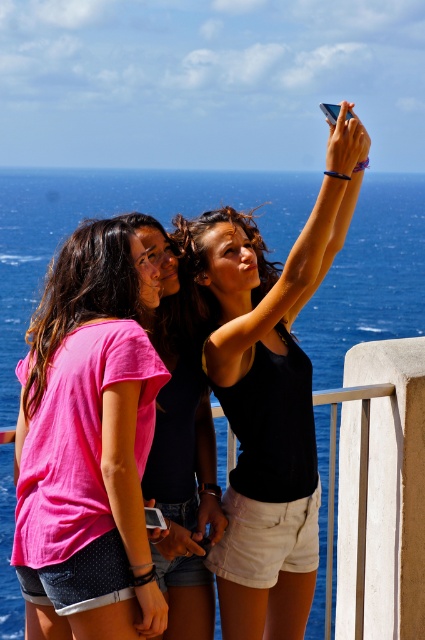
Question: Is black matte tank top at upper center wider than pink cotton t-shirt at center?

Choices:
 (A) yes
 (B) no

Answer: (A)

Question: Which object is the closest to the pink cotton shirt at center?

Choices:
 (A) pink cotton t-shirt at center
 (B) black matte tank top at upper center

Answer: (A)

Question: Which of the following is the closest to the observer?

Choices:
 (A) (306, 250)
 (B) (146, 616)

Answer: (B)

Question: Is pink cotton t-shirt at center behind pink cotton shirt at center?

Choices:
 (A) no
 (B) yes

Answer: (A)

Question: Does pink cotton t-shirt at center have a greater width compared to pink cotton shirt at center?

Choices:
 (A) no
 (B) yes

Answer: (B)

Question: Which object appears closest to the camera in this image?

Choices:
 (A) pink cotton shirt at center
 (B) black matte tank top at upper center

Answer: (B)